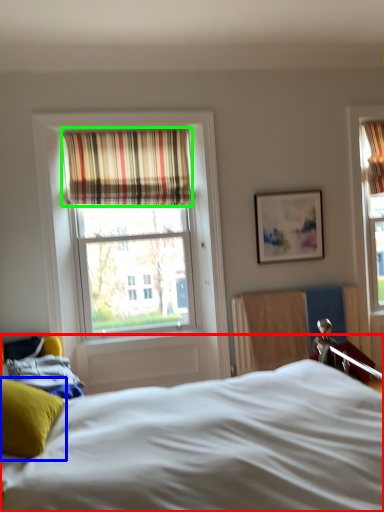
Question: Based on their relative distances, which object is nearer to bed (highlighted by a red box)? Choose from pillow (highlighted by a blue box) and curtain (highlighted by a green box).

Choices:
 (A) pillow
 (B) curtain

Answer: (A)